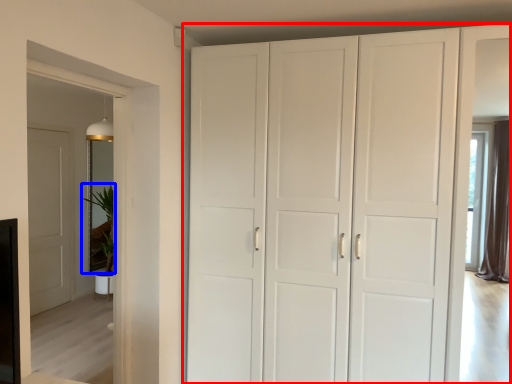
Question: Which object is further to the camera taking this photo, cupboard (highlighted by a red box) or plant (highlighted by a blue box)?

Choices:
 (A) cupboard
 (B) plant

Answer: (B)